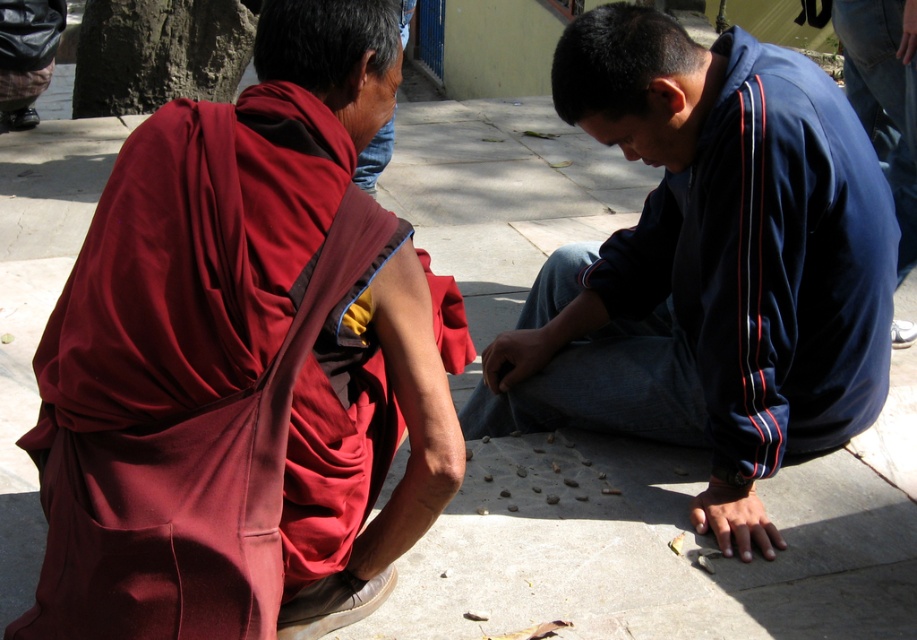
Does maroon silk robe at left have a larger size compared to dark blue velour jacket at center?

No, maroon silk robe at left is not bigger than dark blue velour jacket at center.

Between maroon silk robe at left and dark blue velour jacket at center, which one appears on the right side from the viewer's perspective?

Positioned to the right is dark blue velour jacket at center.

Where is `maroon silk robe at left`? maroon silk robe at left is located at coordinates (245, 362).

Where is `maroon silk robe at left`? The height and width of the screenshot is (640, 917). maroon silk robe at left is located at coordinates (245, 362).